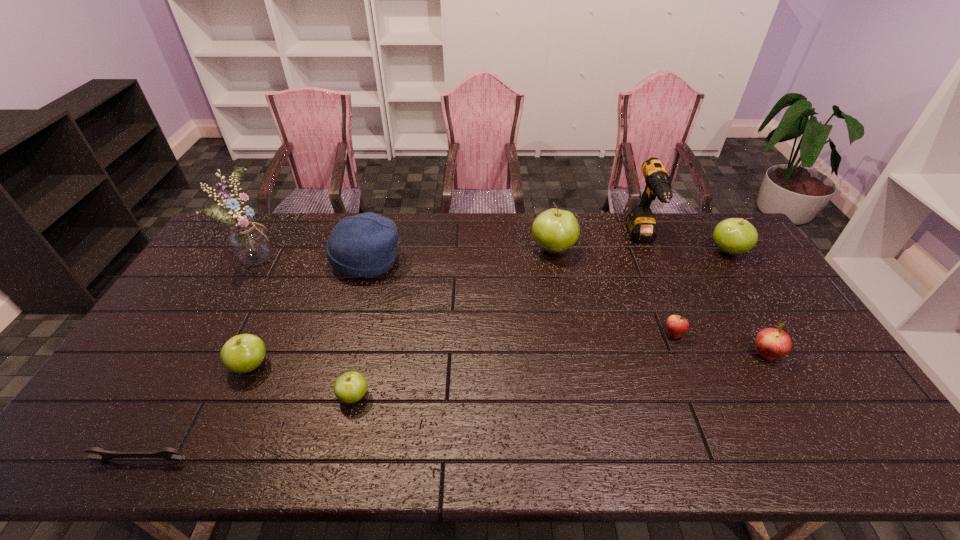
Image resolution: width=960 pixels, height=540 pixels. Identify the location of free location located at the tip of the ninth shortest object. (664, 291).

At what (x,y) coordinates should I click in order to perform the action: click on free space located 0.280m on the left of the skullcap. Please return your answer as a coordinate pair (x, y). The height and width of the screenshot is (540, 960). Looking at the image, I should click on (250, 260).

Locate an element on the screen. This screenshot has height=540, width=960. free spot located on the front of the biggest green apple is located at coordinates [565, 315].

Locate an element on the screen. Image resolution: width=960 pixels, height=540 pixels. free space located on the front of the fifth tallest object is located at coordinates (792, 352).

Locate an element on the screen. This screenshot has width=960, height=540. vacant area located 0.160m on the left of the third biggest green apple is located at coordinates (172, 366).

Where is `free spot located 0.250m on the back of the right red apple`? The width and height of the screenshot is (960, 540). free spot located 0.250m on the back of the right red apple is located at coordinates (723, 282).

Identify the location of free spot located on the left of the fourth apple from left to right. This screenshot has height=540, width=960. (541, 334).

The height and width of the screenshot is (540, 960). I want to click on free space located 0.120m on the right of the smallest green apple, so click(x=417, y=396).

At what (x,y) coordinates should I click in order to perform the action: click on bouquet that is at the far edge. Please return your answer as a coordinate pair (x, y). Looking at the image, I should click on point(249,242).

Locate an element on the screen. Image resolution: width=960 pixels, height=540 pixels. drill that is at the far edge is located at coordinates (641, 225).